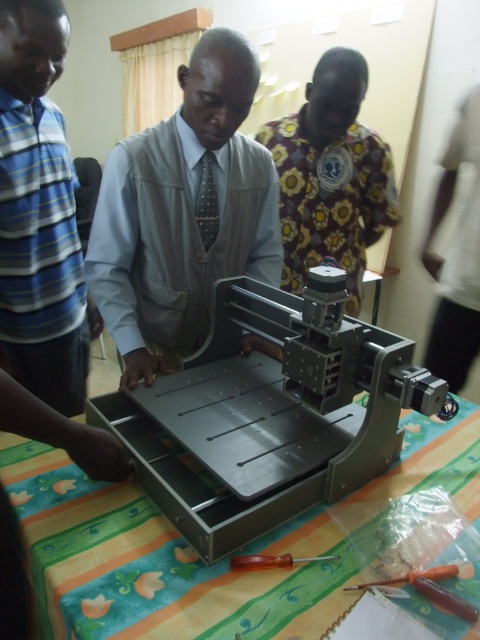
Consider the image. You are an engineer who needs to access the screwdriver at center to perform maintenance on the metallic gray machine at center. Given that the machine is in front of the screwdriver, can you reach the screwdriver without moving the machine?

The metallic gray machine at center is in front of the screwdriver at center, so you cannot reach the screwdriver without moving the machine first.

You are a technician standing at the edge of the table and need to reach both the point at [72,378] and the point at [358,586] on the CNC router. Which point should you reach first to minimize the distance traveled?

You should reach the point at [72,378] first because it is closer to you than the point at [358,586], which is further away.